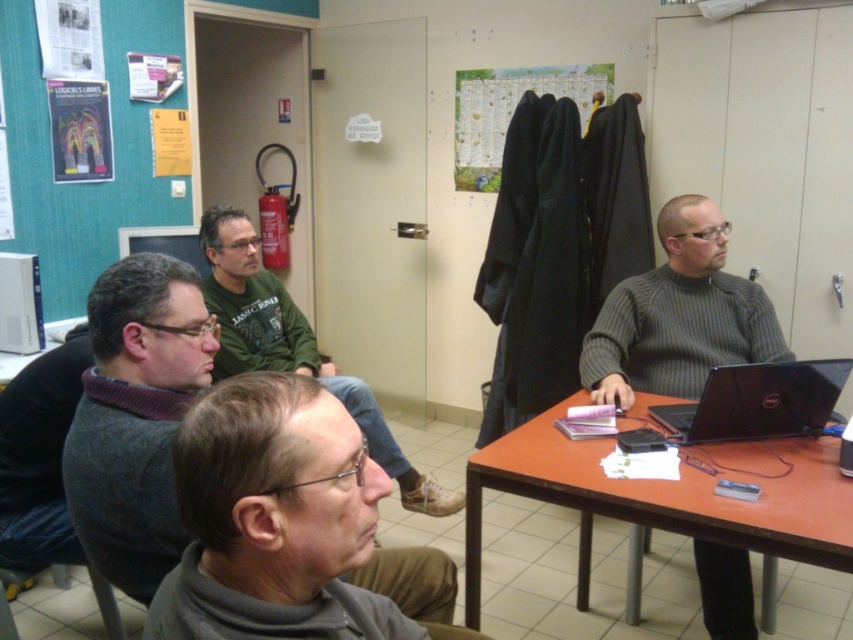
Can you confirm if brown wooden table at right is positioned to the left of black matte laptop at center right?

Yes, brown wooden table at right is to the left of black matte laptop at center right.

Is brown wooden table at right below black matte laptop at center right?

Yes, brown wooden table at right is below black matte laptop at center right.

Is point (808, 442) more distant than point (718, 388)?

Yes, it is.

You are a GUI agent. You are given a task and a screenshot of the screen. Output one action in this format:
    pyautogui.click(x=<x>, y=<y>)
    Task: Click on the brown wooden table at right
    The width and height of the screenshot is (853, 640).
    Given the screenshot: What is the action you would take?
    tap(669, 496)

This screenshot has width=853, height=640. What do you see at coordinates (679, 316) in the screenshot?
I see `gray ribbed sweater at center` at bounding box center [679, 316].

Where is `gray ribbed sweater at center`? This screenshot has width=853, height=640. gray ribbed sweater at center is located at coordinates (679, 316).

Between point (106, 577) and point (3, 300), which one is positioned behind?

The point (3, 300) is more distant.

Locate an element on the screen. Image resolution: width=853 pixels, height=640 pixels. gray sweater at left is located at coordinates (136, 417).